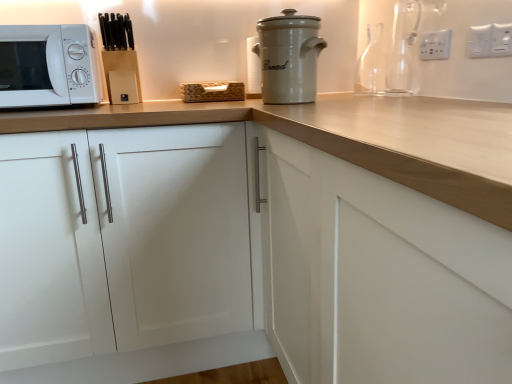
Question: Are white plastic electric outlet at upper right, which is the first electric outlet in back-to-front order, and white matte microwave at left far apart?

Choices:
 (A) no
 (B) yes

Answer: (B)

Question: Is white plastic electric outlet at upper right, the 3th electric outlet from the front, wider than white matte microwave at left?

Choices:
 (A) yes
 (B) no

Answer: (B)

Question: Considering the relative sizes of white plastic electric outlet at upper right, the 3th electric outlet from the front, and white matte microwave at left in the image provided, is white plastic electric outlet at upper right, the 3th electric outlet from the front, thinner than white matte microwave at left?

Choices:
 (A) no
 (B) yes

Answer: (B)

Question: Is white plastic electric outlet at upper right, the 3th electric outlet from the front, not within white matte microwave at left?

Choices:
 (A) no
 (B) yes

Answer: (B)

Question: Is white plastic electric outlet at upper right, the 3th electric outlet when ordered from right to left, closer to camera compared to white matte microwave at left?

Choices:
 (A) no
 (B) yes

Answer: (A)

Question: Can you confirm if white plastic electric outlet at upper right, the 3th electric outlet from the front, is bigger than white matte microwave at left?

Choices:
 (A) yes
 (B) no

Answer: (B)

Question: From a real-world perspective, is transparent glass carafe at upper right, arranged as the first bottle when viewed from the front, physically above white ceramic bread bin at upper center?

Choices:
 (A) yes
 (B) no

Answer: (A)

Question: Is transparent glass carafe at upper right, arranged as the first bottle when viewed from the front, turned away from white ceramic bread bin at upper center?

Choices:
 (A) no
 (B) yes

Answer: (A)

Question: Does transparent glass carafe at upper right, arranged as the first bottle when viewed from the front, come in front of white ceramic bread bin at upper center?

Choices:
 (A) yes
 (B) no

Answer: (B)

Question: Is white ceramic bread bin at upper center a part of transparent glass carafe at upper right, arranged as the first bottle when viewed from the front?

Choices:
 (A) no
 (B) yes

Answer: (A)

Question: Is transparent glass carafe at upper right, arranged as the first bottle when viewed from the front, to the left of white ceramic bread bin at upper center from the viewer's perspective?

Choices:
 (A) yes
 (B) no

Answer: (B)

Question: Is transparent glass carafe at upper right, arranged as the first bottle when viewed from the front, positioned behind white ceramic bread bin at upper center?

Choices:
 (A) no
 (B) yes

Answer: (B)

Question: Can you confirm if white ceramic bread bin at upper center is positioned to the right of white plastic electric outlet at upper right, acting as the third electric outlet starting from the back?

Choices:
 (A) no
 (B) yes

Answer: (A)